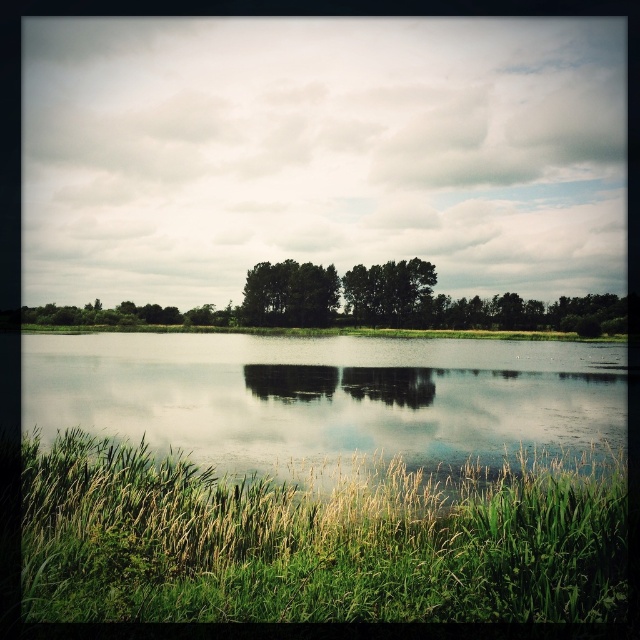
Question: Which point is farther to the camera?

Choices:
 (A) green matte tree at center
 (B) green matte trees at center
 (C) transparent water at center
 (D) green grassy at lower left

Answer: (B)

Question: Is transparent water at center thinner than green matte tree at center?

Choices:
 (A) no
 (B) yes

Answer: (A)

Question: Among these objects, which one is nearest to the camera?

Choices:
 (A) green grassy at lower left
 (B) green matte tree at center

Answer: (A)

Question: Which point is farther to the camera?

Choices:
 (A) (371, 321)
 (B) (564, 356)

Answer: (A)

Question: Does green matte trees at center have a lesser width compared to green matte tree at center?

Choices:
 (A) no
 (B) yes

Answer: (A)

Question: Does green matte trees at center have a smaller size compared to green matte tree at center?

Choices:
 (A) no
 (B) yes

Answer: (A)